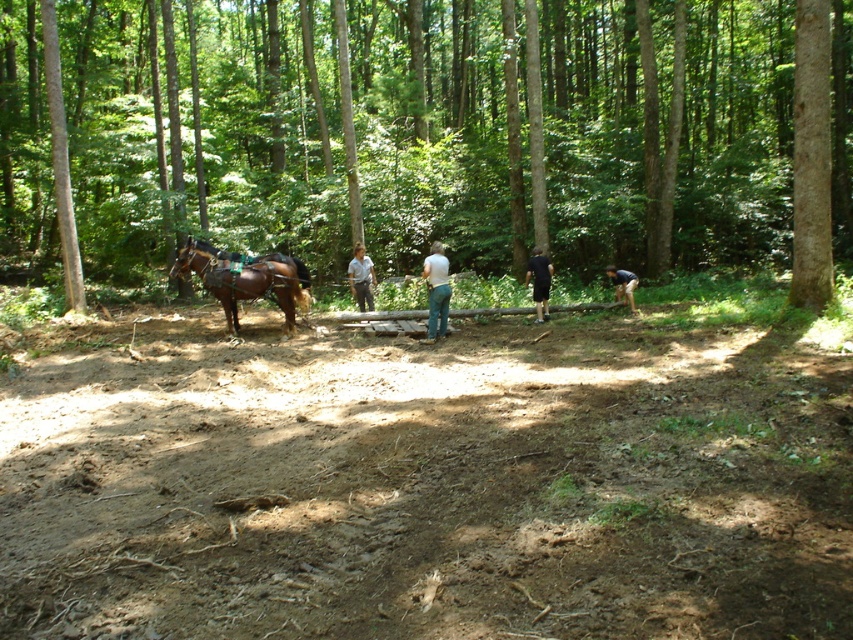
You are a photographer planning to take a picture of the brown wood tree at left and the white cotton shirt at center in the forest clearing. Considering their sizes, which object should you focus on first to ensure it is fully captured in the frame?

The brown wood tree at left is larger in size than the white cotton shirt at center, so you should focus on capturing the brown wood tree at left first to ensure its entire structure fits within the frame.

You are standing in the forest clearing and want to walk towards the light brown leather jacket at center. Which direction should you move relative to the brown dirt track at center?

You should move away from the brown dirt track at center because the light brown leather jacket at center is farther from the viewer than the brown dirt track at center.